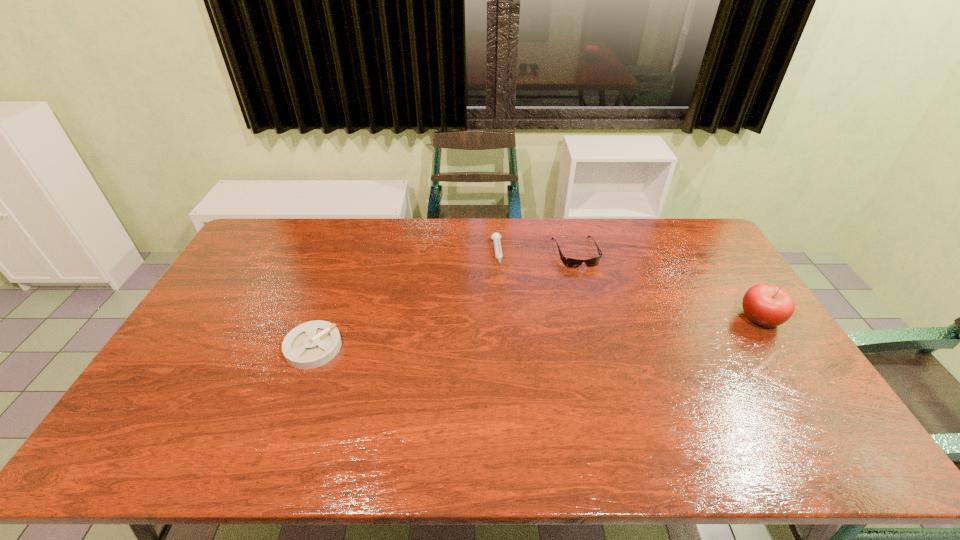
Identify the location of ashtray. (312, 344).

Where is `the tallest object`? Image resolution: width=960 pixels, height=540 pixels. the tallest object is located at coordinates (767, 305).

Identify the location of the rightmost object. (767, 305).

This screenshot has width=960, height=540. I want to click on the second object from left to right, so click(x=496, y=237).

The image size is (960, 540). In order to click on syringe in this screenshot , I will do click(496, 237).

Where is `the second object from right to left`? the second object from right to left is located at coordinates (568, 262).

At what (x,y) coordinates should I click in order to perform the action: click on free space located on the back of the leftmost object. Please return your answer as a coordinate pair (x, y). The image size is (960, 540). Looking at the image, I should click on (344, 264).

Where is `vacant space located 0.300m on the back of the rightmost object`? Image resolution: width=960 pixels, height=540 pixels. vacant space located 0.300m on the back of the rightmost object is located at coordinates point(712,246).

Where is `free point located at the needle end of the shortest object`? Image resolution: width=960 pixels, height=540 pixels. free point located at the needle end of the shortest object is located at coordinates (504, 314).

I want to click on vacant position located 0.210m at the needle end of the shortest object, so click(504, 316).